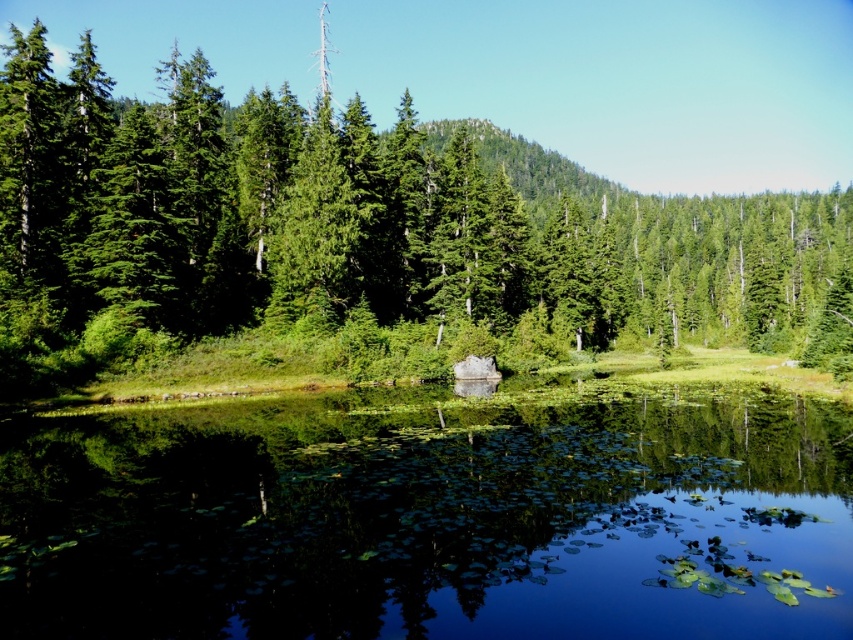
Question: Which point is farther to the camera?

Choices:
 (A) green matte tree at center
 (B) green reflective water at center

Answer: (A)

Question: Which point is farther to the camera?

Choices:
 (A) (186, 141)
 (B) (3, 504)

Answer: (A)

Question: From the image, what is the correct spatial relationship of green reflective water at center in relation to green matte tree at center?

Choices:
 (A) left
 (B) right

Answer: (A)

Question: Does green reflective water at center have a lesser width compared to green matte tree at center?

Choices:
 (A) no
 (B) yes

Answer: (B)

Question: In this image, where is green reflective water at center located relative to green matte tree at center?

Choices:
 (A) below
 (B) above

Answer: (A)